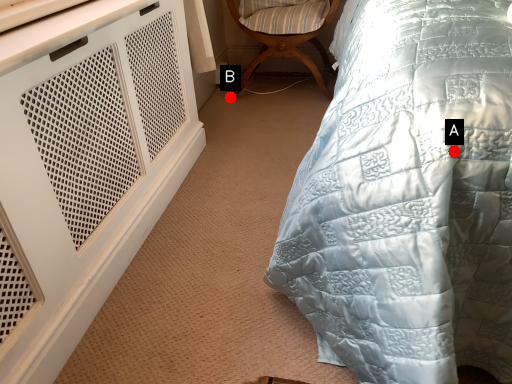
Question: Two points are circled on the image, labeled by A and B beside each circle. Which of the following is the farthest from the observer?

Choices:
 (A) A is further
 (B) B is further

Answer: (B)